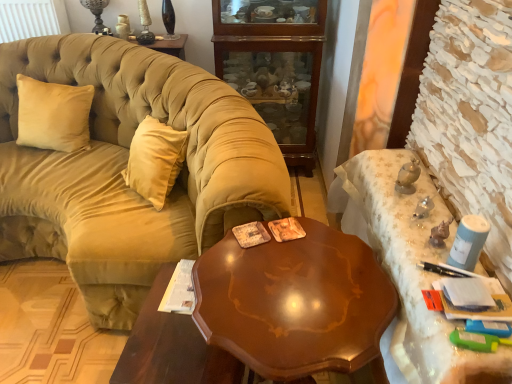
Question: Is wooden cabinet at center positioned before glossy wood table at center?

Choices:
 (A) no
 (B) yes

Answer: (A)

Question: Is wooden cabinet at center wider than glossy wood table at center?

Choices:
 (A) no
 (B) yes

Answer: (B)

Question: Can glossy wood table at center be found inside wooden cabinet at center?

Choices:
 (A) no
 (B) yes

Answer: (A)

Question: Is wooden cabinet at center at the right side of glossy wood table at center?

Choices:
 (A) no
 (B) yes

Answer: (B)

Question: Is wooden cabinet at center touching glossy wood table at center?

Choices:
 (A) yes
 (B) no

Answer: (B)

Question: Considering the relative sizes of wooden cabinet at center and glossy wood table at center in the image provided, is wooden cabinet at center shorter than glossy wood table at center?

Choices:
 (A) yes
 (B) no

Answer: (B)

Question: Is white lace tablecloth at right, which ranks as the 2th desk in left-to-right order, far away from beige velvet pillow at left?

Choices:
 (A) yes
 (B) no

Answer: (A)

Question: Is white lace tablecloth at right, which is the 1th desk from right to left, taller than beige velvet pillow at left?

Choices:
 (A) no
 (B) yes

Answer: (B)

Question: From a real-world perspective, is white lace tablecloth at right, which ranks as the 2th desk in left-to-right order, over beige velvet pillow at left?

Choices:
 (A) no
 (B) yes

Answer: (A)

Question: Is white lace tablecloth at right, which is the 1th desk from right to left, not inside beige velvet pillow at left?

Choices:
 (A) no
 (B) yes

Answer: (B)

Question: From a real-world perspective, is white lace tablecloth at right, which ranks as the 2th desk in left-to-right order, below beige velvet pillow at left?

Choices:
 (A) no
 (B) yes

Answer: (B)

Question: Is white lace tablecloth at right, which is the 1th desk from right to left, aimed at beige velvet pillow at left?

Choices:
 (A) no
 (B) yes

Answer: (B)

Question: Can we say glossy wood table at center lies outside velvet beige couch at left?

Choices:
 (A) no
 (B) yes

Answer: (B)